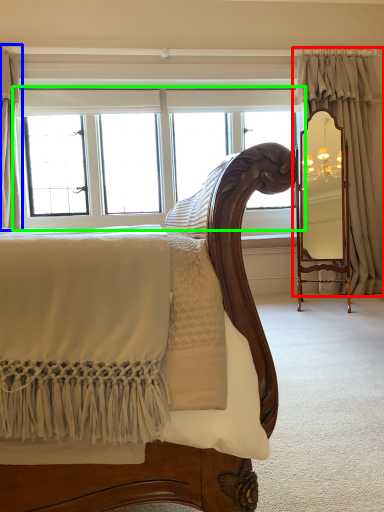
Question: Which object is the closest to the curtain (highlighted by a red box)? Choose among these: curtain (highlighted by a blue box) or window (highlighted by a green box).

Choices:
 (A) curtain
 (B) window

Answer: (B)